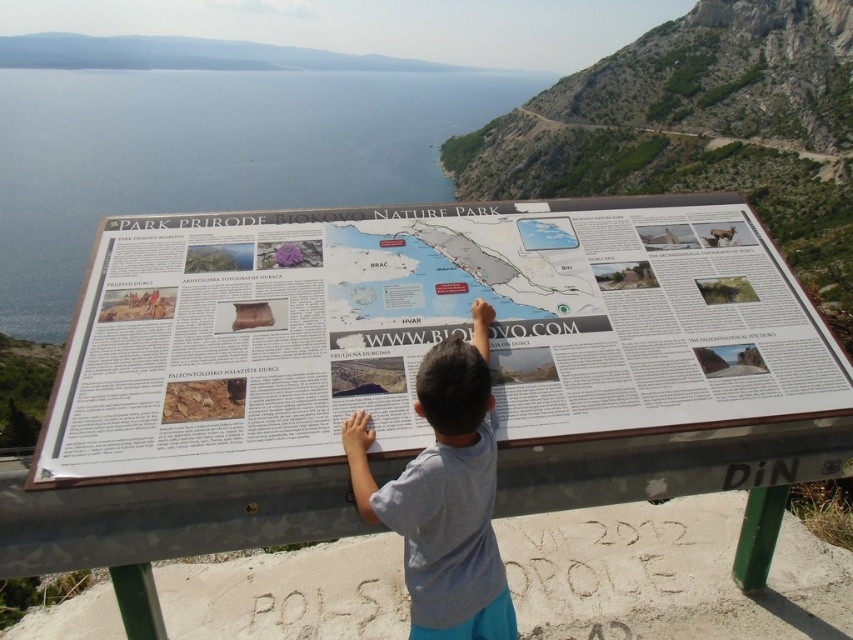
Question: Can you confirm if white plastic map at center is thinner than gray cotton shirt at center?

Choices:
 (A) no
 (B) yes

Answer: (A)

Question: Which point is farther to the camera?

Choices:
 (A) gray cotton shirt at center
 (B) white plastic map at center

Answer: (A)

Question: Is white plastic map at center to the right of gray cotton shirt at center from the viewer's perspective?

Choices:
 (A) no
 (B) yes

Answer: (B)

Question: In this image, where is white plastic map at center located relative to gray cotton shirt at center?

Choices:
 (A) right
 (B) left

Answer: (A)

Question: Among these objects, which one is farthest from the camera?

Choices:
 (A) white plastic map at center
 (B) gray cotton shirt at center

Answer: (B)